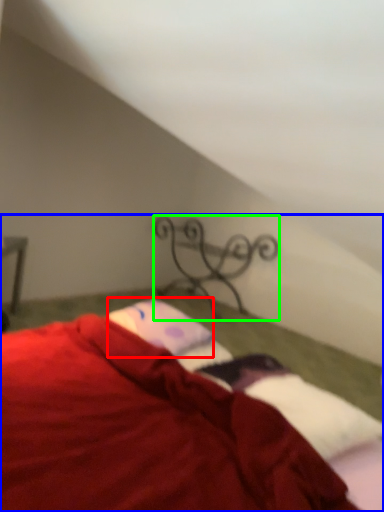
Question: Estimate the real-world distances between objects in this image. Which object is closer to pillow (highlighted by a red box), bed (highlighted by a blue box) or design (highlighted by a green box)?

Choices:
 (A) bed
 (B) design

Answer: (A)